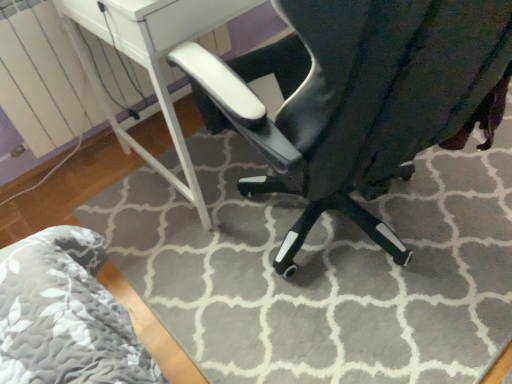
Question: In terms of height, does glossy black chair at center look taller or shorter compared to white glossy table at center?

Choices:
 (A) tall
 (B) short

Answer: (A)

Question: From the image's perspective, is glossy black chair at center positioned above or below white glossy table at center?

Choices:
 (A) below
 (B) above

Answer: (A)

Question: Is glossy black chair at center inside the boundaries of white glossy table at center, or outside?

Choices:
 (A) outside
 (B) inside

Answer: (A)

Question: In terms of size, does white glossy table at center appear bigger or smaller than glossy black chair at center?

Choices:
 (A) big
 (B) small

Answer: (B)

Question: From the image's perspective, is white glossy table at center positioned above or below glossy black chair at center?

Choices:
 (A) above
 (B) below

Answer: (A)

Question: Is white glossy table at center wider or thinner than glossy black chair at center?

Choices:
 (A) thin
 (B) wide

Answer: (A)

Question: In terms of height, does white glossy table at center look taller or shorter compared to glossy black chair at center?

Choices:
 (A) tall
 (B) short

Answer: (B)